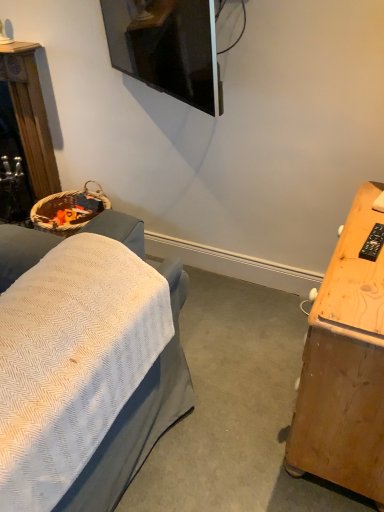
This screenshot has width=384, height=512. In order to click on free area behind light brown wood desk at right in this screenshot , I will do `click(261, 320)`.